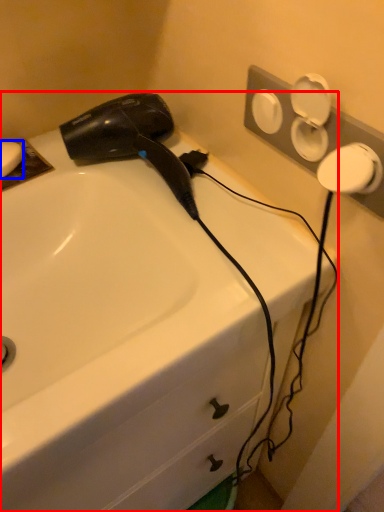
Question: Which of the following is the farthest to the observer, sink (highlighted by a red box) or soap (highlighted by a blue box)?

Choices:
 (A) sink
 (B) soap

Answer: (B)